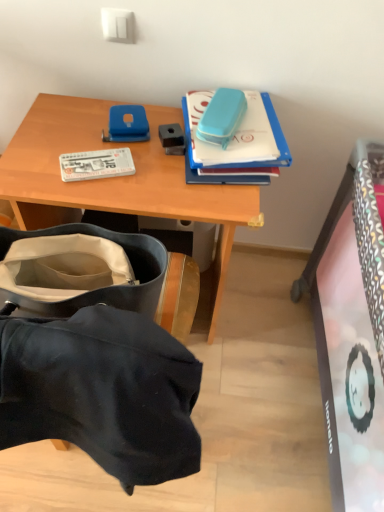
Question: From the image's perspective, is wooden desk at upper center located above or below blue matte case at upper right, the first book when ordered from right to left?

Choices:
 (A) above
 (B) below

Answer: (B)

Question: Looking at their shapes, would you say wooden desk at upper center is wider or thinner than blue matte case at upper right, arranged as the second book when viewed from the left?

Choices:
 (A) wide
 (B) thin

Answer: (A)

Question: Considering the real-world distances, which object is farthest from the white matte book at left, the 1th book when ordered from left to right?

Choices:
 (A) dark blue fabric bag at lower left
 (B) wooden desk at upper center
 (C) blue matte case at upper right, arranged as the second book when viewed from the left

Answer: (A)

Question: Which object is positioned closest to the wooden desk at upper center?

Choices:
 (A) blue matte case at upper right, arranged as the second book when viewed from the left
 (B) white matte book at left, the 2th book viewed from the right
 (C) dark blue fabric bag at lower left

Answer: (B)